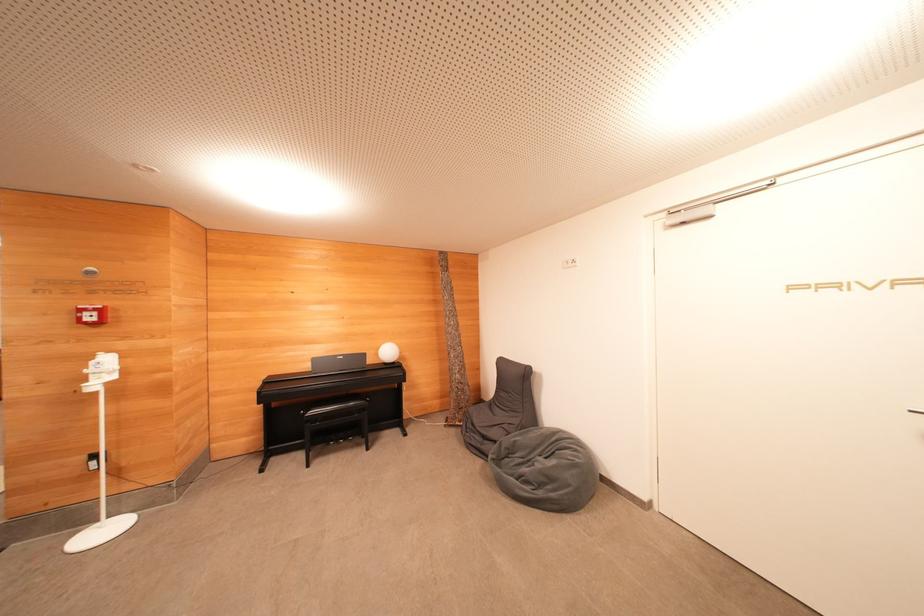
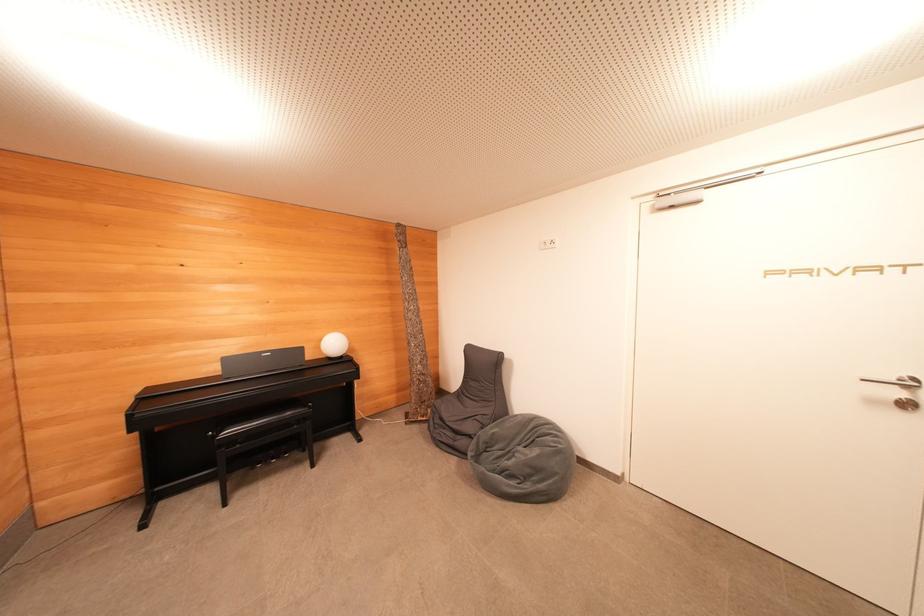
In the second image, find the point that corresponds to (x=556, y=466) in the first image.

(540, 455)